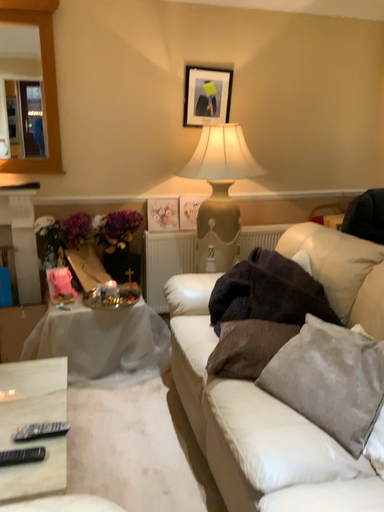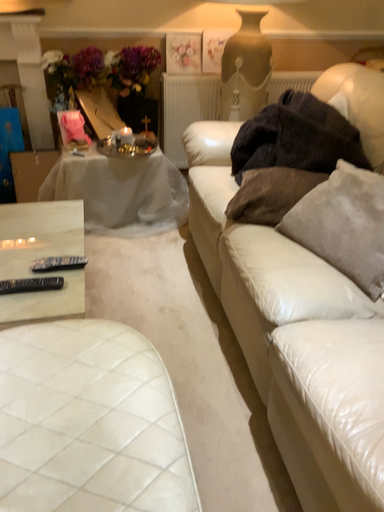
Question: How did the camera likely rotate when shooting the video?

Choices:
 (A) rotated downward
 (B) rotated upward

Answer: (A)